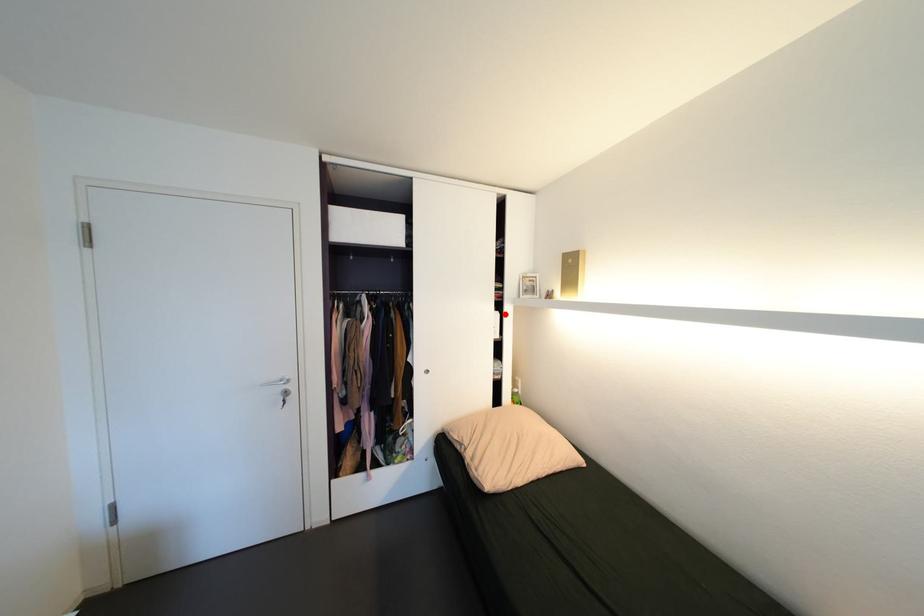
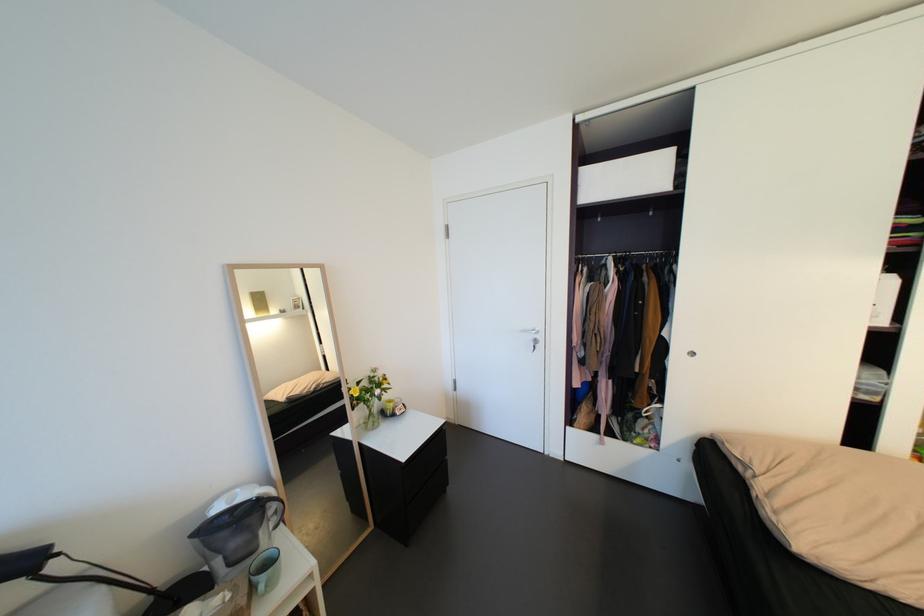
Find the pixel in the second image that matches the highlighted location in the first image.

(900, 278)